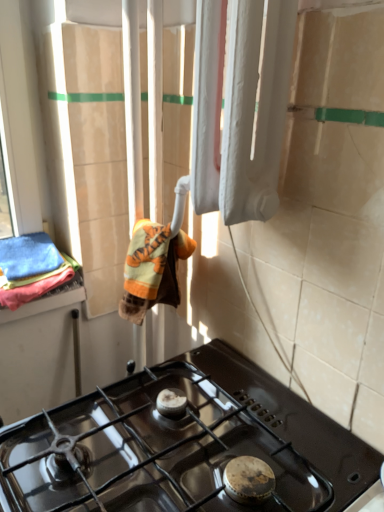
Question: Is orange plush bath towel at center, acting as the second bath towel starting from the left, facing away from soft cotton towels at left, marked as the first bath towel in a left-to-right arrangement?

Choices:
 (A) no
 (B) yes

Answer: (A)

Question: Could soft cotton towels at left, the 2th bath towel from the right, be considered to be inside orange plush bath towel at center, which appears as the 1th bath towel when viewed from the right?

Choices:
 (A) no
 (B) yes

Answer: (A)

Question: Does orange plush bath towel at center, acting as the second bath towel starting from the left, have a larger size compared to soft cotton towels at left, the 2th bath towel from the right?

Choices:
 (A) yes
 (B) no

Answer: (B)

Question: Is orange plush bath towel at center, acting as the second bath towel starting from the left, to the left of soft cotton towels at left, marked as the first bath towel in a left-to-right arrangement, from the viewer's perspective?

Choices:
 (A) yes
 (B) no

Answer: (B)

Question: Does orange plush bath towel at center, acting as the second bath towel starting from the left, have a smaller size compared to soft cotton towels at left, marked as the first bath towel in a left-to-right arrangement?

Choices:
 (A) no
 (B) yes

Answer: (B)

Question: Looking at their shapes, would you say soft cotton towels at left, marked as the first bath towel in a left-to-right arrangement, is wider or thinner than white matte radiator at upper center?

Choices:
 (A) wide
 (B) thin

Answer: (A)

Question: Would you say soft cotton towels at left, the 2th bath towel from the right, is to the left or to the right of white matte radiator at upper center in the picture?

Choices:
 (A) right
 (B) left

Answer: (B)

Question: From the image's perspective, is soft cotton towels at left, the 2th bath towel from the right, positioned above or below white matte radiator at upper center?

Choices:
 (A) above
 (B) below

Answer: (B)

Question: From a real-world perspective, is soft cotton towels at left, the 2th bath towel from the right, physically located above or below white matte radiator at upper center?

Choices:
 (A) above
 (B) below

Answer: (B)

Question: Is soft cotton towels at left, the 2th bath towel from the right, to the left or to the right of black glass gas stove at lower center in the image?

Choices:
 (A) left
 (B) right

Answer: (A)

Question: In terms of width, does soft cotton towels at left, marked as the first bath towel in a left-to-right arrangement, look wider or thinner when compared to black glass gas stove at lower center?

Choices:
 (A) thin
 (B) wide

Answer: (A)

Question: Considering the positions of point (52, 285) and point (99, 441), is point (52, 285) closer or farther from the camera than point (99, 441)?

Choices:
 (A) farther
 (B) closer

Answer: (A)

Question: From a real-world perspective, relative to black glass gas stove at lower center, is soft cotton towels at left, marked as the first bath towel in a left-to-right arrangement, vertically above or below?

Choices:
 (A) below
 (B) above

Answer: (B)

Question: Based on their sizes in the image, would you say white matte radiator at upper center is bigger or smaller than orange plush bath towel at center, which appears as the 1th bath towel when viewed from the right?

Choices:
 (A) small
 (B) big

Answer: (B)

Question: Is white matte radiator at upper center taller or shorter than orange plush bath towel at center, acting as the second bath towel starting from the left?

Choices:
 (A) tall
 (B) short

Answer: (A)